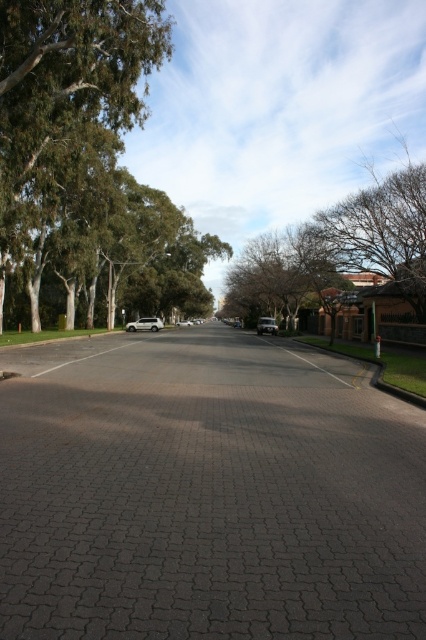
You are standing on the residential street and want to take a photo of both point (271,317) and point (236,323). Which point should you focus on first to ensure both are in clear view?

You should focus on point (271,317) first because it is closer to the camera than point (236,323). By focusing on the closer point, both points will be in clear view due to the depth of field.

You are standing on the residential street and want to cross the road safely. There are two metallic silver cars parked at the center of the road. The first is labeled as the silver metallic car at center, and the second is the metallic silver sedan at center. Given that the distance between them is 47.38 meters, can you walk between them without crossing the entire road?

The distance between the silver metallic car at center and the metallic silver sedan at center is 47.38 meters. Since this distance is quite large, you can walk between them without needing to cross the entire road, as there is sufficient space between the two vehicles.

You are standing at the center of the street and want to take a photo of the green leafy tree at upper left. Based on its coordinates, in which direction should you point your camera to capture it?

The green leafy tree at upper left is located at coordinates point (86, 168), which is in the upper left area of the image. Therefore, you should point your camera towards the upper left direction to capture it.